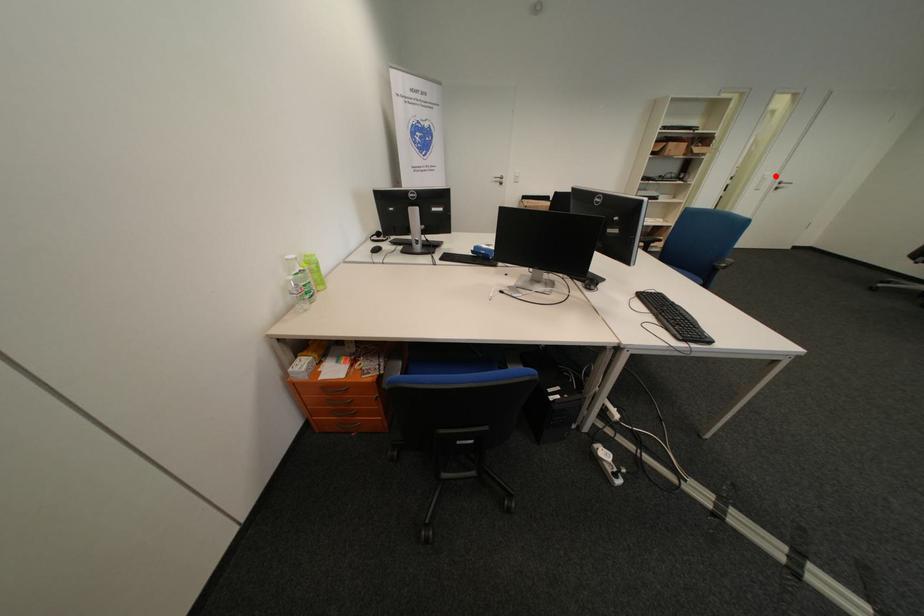
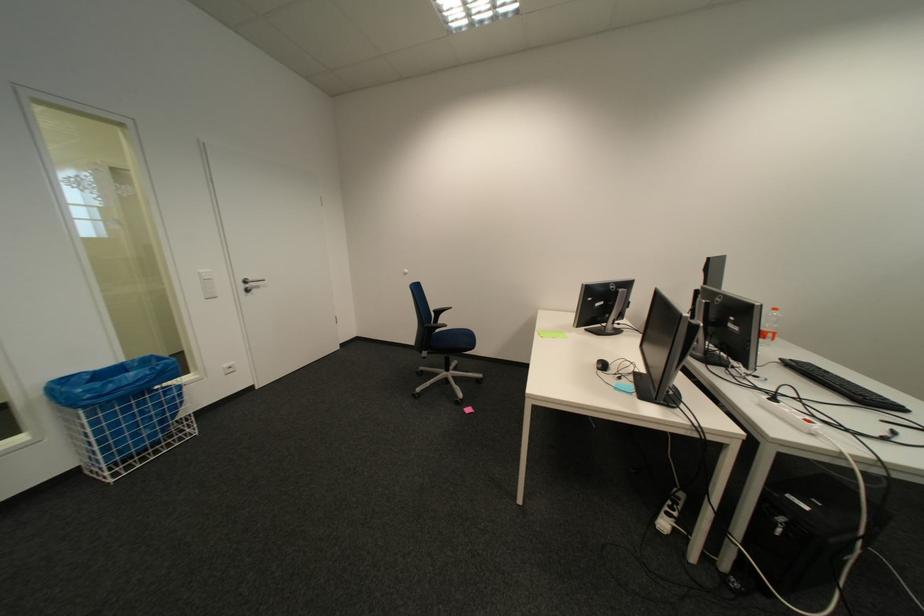
Question: I am providing you with two images of the same scene from different viewpoints. A red point is marked on the first image. At the location where the point appears in image 1, is it still visible in image 2?

Choices:
 (A) Yes
 (B) No

Answer: (A)